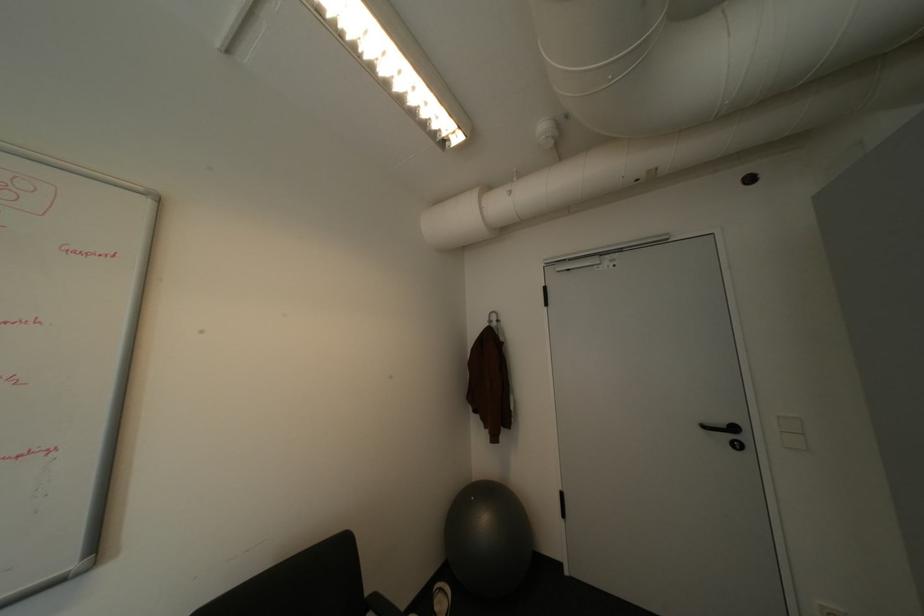
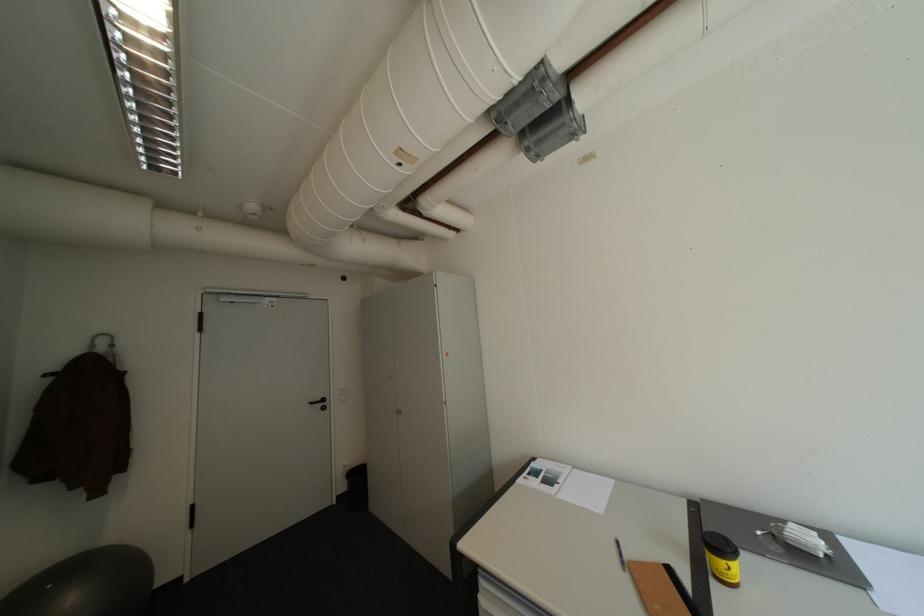
The point at (504, 318) is marked in the first image. Where is the corresponding point in the second image?

(113, 342)